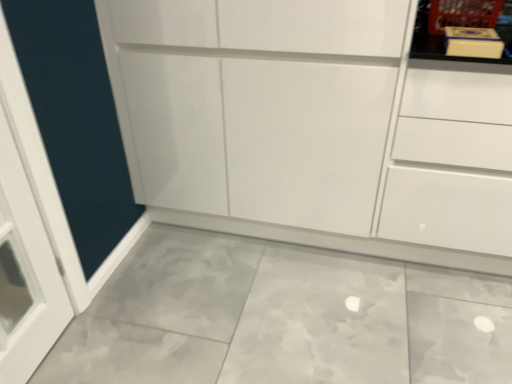
The height and width of the screenshot is (384, 512). In order to click on white glossy cupboard at center in this screenshot , I will do `click(312, 128)`.

The image size is (512, 384). What do you see at coordinates (451, 159) in the screenshot?
I see `white glossy drawer at upper right` at bounding box center [451, 159].

Locate an element on the screen. matte yellow book at upper right is located at coordinates (460, 25).

Does point (114, 74) come closer to viewer compared to point (432, 0)?

That is False.

Image resolution: width=512 pixels, height=384 pixels. In order to click on cupboard below the matte yellow book at upper right (from a real-world perspective) in this screenshot , I will do `click(312, 128)`.

Can you tell me how much white glossy cupboard at center and matte yellow book at upper right differ in facing direction?

The angular difference between white glossy cupboard at center and matte yellow book at upper right is 0.559 degrees.

Which object is closer to the camera, white glossy cupboard at center or matte yellow book at upper right?

white glossy cupboard at center is more forward.

Based on the photo, is white glossy drawer at upper right not near white glossy cupboard at center?

No, there isn't a large distance between white glossy drawer at upper right and white glossy cupboard at center.

Looking at this image, which is less distant, (458, 81) or (210, 155)?

Point (458, 81) is closer to the camera than point (210, 155).

From the image's perspective, is white glossy drawer at upper right on white glossy cupboard at center?

No, from the image's perspective, white glossy drawer at upper right is not over white glossy cupboard at center.

Can you confirm if white glossy drawer at upper right is wider than white glossy cupboard at center?

Incorrect, the width of white glossy drawer at upper right does not surpass that of white glossy cupboard at center.

From a real-world perspective, is matte yellow book at upper right physically above white glossy cupboard at center?

Indeed, from a real-world perspective, matte yellow book at upper right stands above white glossy cupboard at center.

Which is in front, point (419, 34) or point (282, 140)?

Point (419, 34)

Would you consider matte yellow book at upper right to be distant from white glossy cupboard at center?

No, matte yellow book at upper right is in close proximity to white glossy cupboard at center.

How far apart are matte yellow book at upper right and white glossy cupboard at center?

The distance of matte yellow book at upper right from white glossy cupboard at center is 19.05 inches.

Find the location of a particular element. cupboard on the left side of white glossy drawer at upper right is located at coordinates (312, 128).

Is white glossy cupboard at center located outside white glossy drawer at upper right?

white glossy cupboard at center is positioned outside white glossy drawer at upper right.

Which object is positioned more to the left, white glossy cupboard at center or white glossy drawer at upper right?

white glossy cupboard at center is more to the left.

Between white glossy cupboard at center and white glossy drawer at upper right, which one has smaller size?

Smaller between the two is white glossy drawer at upper right.

Does white glossy drawer at upper right have a greater height compared to matte yellow book at upper right?

Indeed, white glossy drawer at upper right has a greater height compared to matte yellow book at upper right.

Considering the relative sizes of white glossy drawer at upper right and matte yellow book at upper right in the image provided, is white glossy drawer at upper right smaller than matte yellow book at upper right?

Actually, white glossy drawer at upper right might be larger than matte yellow book at upper right.

From the picture: Would you say white glossy drawer at upper right contains matte yellow book at upper right?

That's correct, matte yellow book at upper right is inside white glossy drawer at upper right.

Which of these two, white glossy drawer at upper right or matte yellow book at upper right, is thinner?

matte yellow book at upper right.

Identify the location of drawer below the matte yellow book at upper right (from a real-world perspective). (451, 159).

Which of these two, matte yellow book at upper right or white glossy drawer at upper right, is thinner?

matte yellow book at upper right.

Could you tell me if matte yellow book at upper right is turned towards white glossy drawer at upper right?

No, matte yellow book at upper right is not turned towards white glossy drawer at upper right.

From a real-world perspective, does matte yellow book at upper right sit lower than white glossy drawer at upper right?

No.

At what (x,y) coordinates should I click in order to perform the action: click on shelf on the right of white glossy cupboard at center. Please return your answer as a coordinate pair (x, y). Looking at the image, I should click on pyautogui.click(x=460, y=25).

Locate an element on the screen. drawer in front of the white glossy cupboard at center is located at coordinates (451, 159).

Looking at the image, which one is located further to white glossy drawer at upper right, white glossy cupboard at center or matte yellow book at upper right?

Among the two, matte yellow book at upper right is located further to white glossy drawer at upper right.

Estimate the real-world distances between objects in this image. Which object is further from matte yellow book at upper right, white glossy cupboard at center or white glossy drawer at upper right?

The object further to matte yellow book at upper right is white glossy cupboard at center.

When comparing their distances from white glossy cupboard at center, does matte yellow book at upper right or white glossy drawer at upper right seem closer?

Among the two, white glossy drawer at upper right is located nearer to white glossy cupboard at center.

Looking at the image, which one is located closer to white glossy cupboard at center, white glossy drawer at upper right or matte yellow book at upper right?

white glossy drawer at upper right is closer to white glossy cupboard at center.

Considering their positions, is matte yellow book at upper right positioned further to white glossy drawer at upper right than white glossy cupboard at center?

Among the two, matte yellow book at upper right is located further to white glossy drawer at upper right.

Which object lies further to the anchor point matte yellow book at upper right, white glossy drawer at upper right or white glossy cupboard at center?

The object further to matte yellow book at upper right is white glossy cupboard at center.

Where is `shelf between white glossy cupboard at center and white glossy drawer at upper right in the horizontal direction`? The height and width of the screenshot is (384, 512). shelf between white glossy cupboard at center and white glossy drawer at upper right in the horizontal direction is located at coordinates (460, 25).